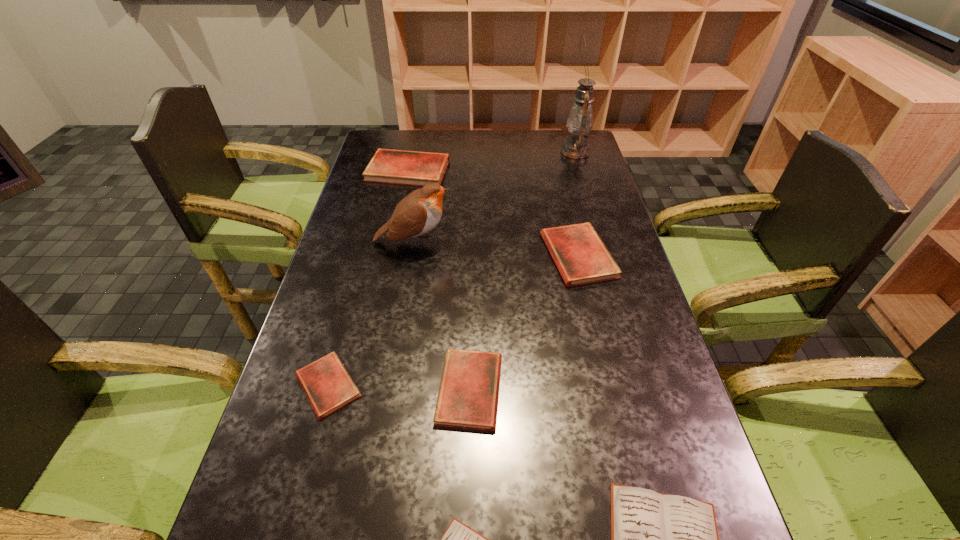
I want to click on diary that is the fifth nearest to the smallest red diary, so click(x=415, y=168).

Find the location of `red diary that stands as the third closest to the right white diary`. red diary that stands as the third closest to the right white diary is located at coordinates (581, 257).

Point out which red diary is positioned as the nearest to the biggest red diary. Please provide its 2D coordinates. Your answer should be formatted as a tuple, i.e. [(x, y)], where the tuple contains the x and y coordinates of a point satisfying the conditions above.

[(581, 257)]

Locate an element on the screen. Image resolution: width=960 pixels, height=540 pixels. free spot that satisfies the following two spatial constraints: 1. at the face of the seventh shortest object; 2. on the left side of the second smallest red diary is located at coordinates (390, 389).

The image size is (960, 540). In order to click on blank area in the image that satisfies the following two spatial constraints: 1. on the back side of the tallest object; 2. on the right side of the fifth shortest object in this screenshot , I will do `click(554, 151)`.

The width and height of the screenshot is (960, 540). In order to click on free space that satisfies the following two spatial constraints: 1. on the back side of the oil lamp; 2. on the left side of the rightmost red diary in this screenshot , I will do `click(554, 151)`.